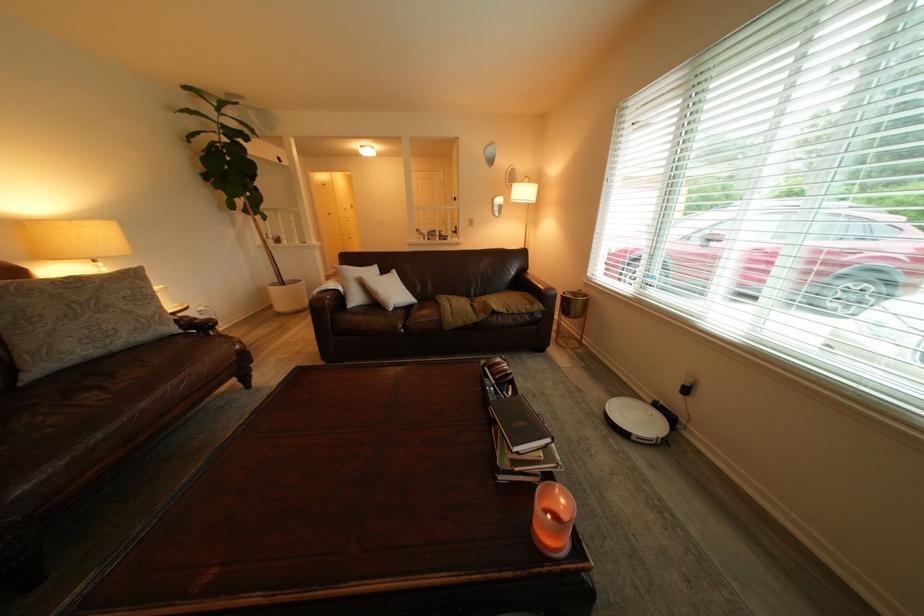
What do you see at coordinates (472, 222) in the screenshot?
I see `the brass door knob` at bounding box center [472, 222].